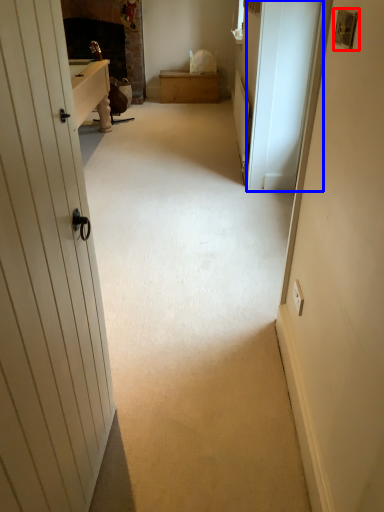
Question: Which object appears farthest to the camera in this image, lock (highlighted by a red box) or screen door (highlighted by a blue box)?

Choices:
 (A) lock
 (B) screen door

Answer: (B)